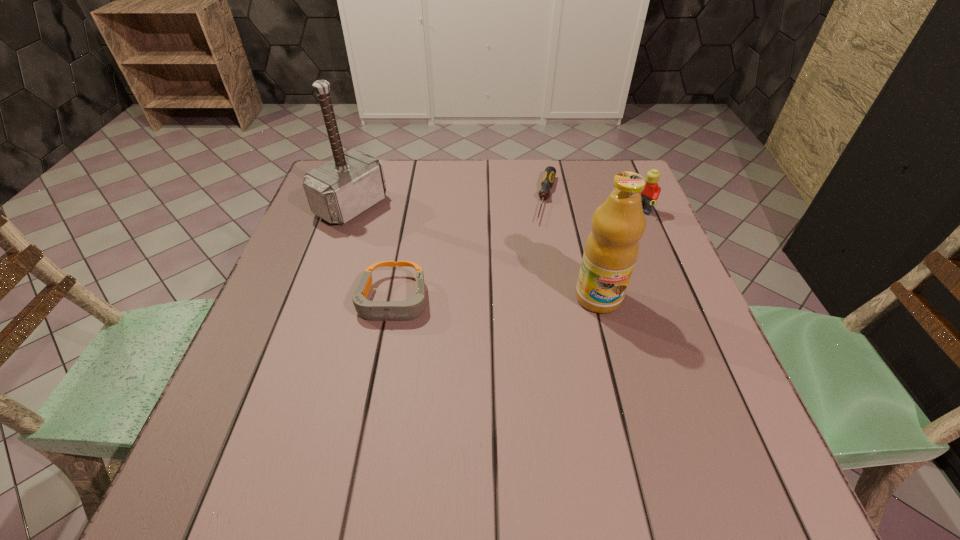
Where is `free spot at the near right corner of the desktop`? free spot at the near right corner of the desktop is located at coordinates (672, 390).

I want to click on free area in between the shortest object and the olive oil, so click(572, 248).

Locate an element on the screen. empty space that is in between the hammer and the olive oil is located at coordinates (475, 252).

You are a GUI agent. You are given a task and a screenshot of the screen. Output one action in this format:
    pyautogui.click(x=<x>, y=<y>)
    Task: Click on the vacant region between the shortest object and the hammer
    
    Given the screenshot: What is the action you would take?
    pyautogui.click(x=449, y=202)

I want to click on unoccupied position between the olive oil and the shortest object, so click(x=572, y=248).

Locate an element on the screen. free space between the second shortest object and the screwdriver is located at coordinates (469, 249).

I want to click on free area in between the olive oil and the shortest object, so click(x=572, y=248).

Find the location of `free space between the hammer and the third shortest object`. free space between the hammer and the third shortest object is located at coordinates [496, 209].

Find the location of a particular element. empty location between the shortest object and the olive oil is located at coordinates (572, 248).

What are the coordinates of `free spot between the screwdriver and the fourth tallest object` in the screenshot? It's located at [x=469, y=249].